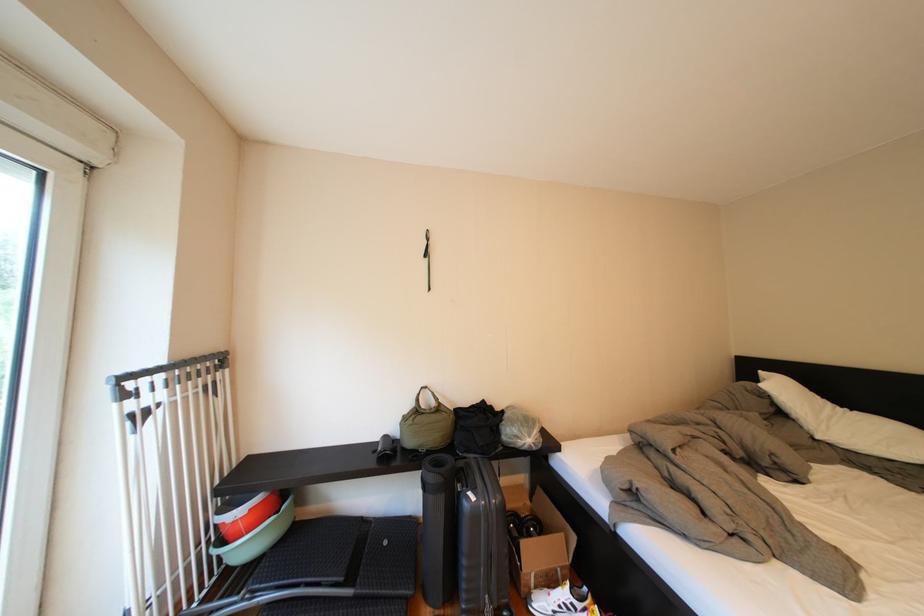
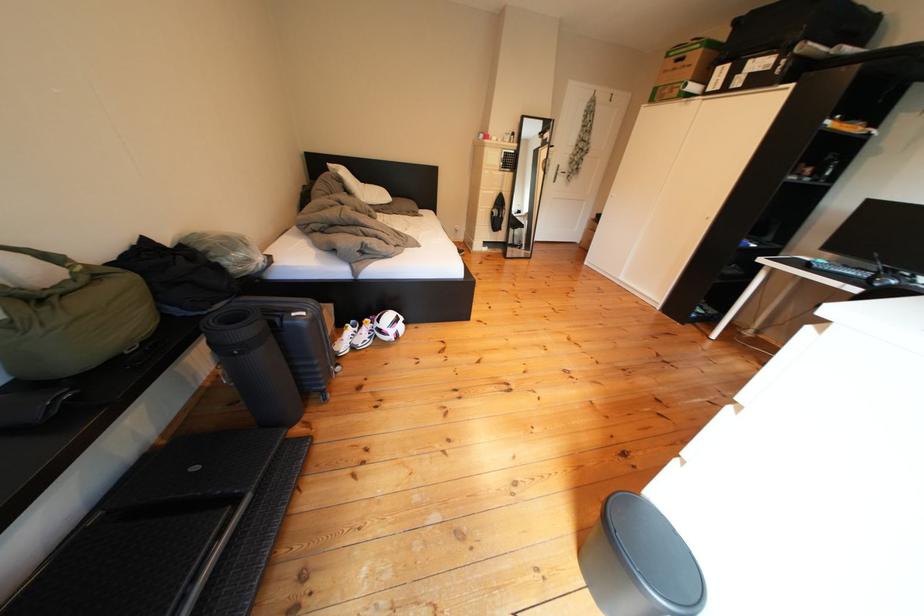
Locate, in the second image, the point that corresponds to the point at 487,503 in the first image.

(317, 318)